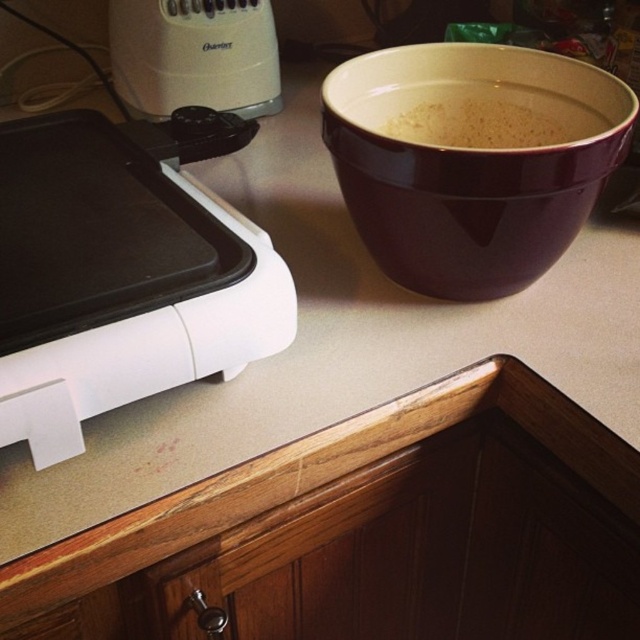
Question: Which point is farther to the camera?

Choices:
 (A) white matte powder at upper center
 (B) white glossy electric griddle at left
 (C) white plastic blender at upper left

Answer: (C)

Question: Can you confirm if white glossy electric griddle at left is positioned to the left of white plastic blender at upper left?

Choices:
 (A) no
 (B) yes

Answer: (B)

Question: In this image, where is white glossy electric griddle at left located relative to white plastic blender at upper left?

Choices:
 (A) below
 (B) above

Answer: (A)

Question: Does white glossy electric griddle at left appear on the right side of white matte powder at upper center?

Choices:
 (A) yes
 (B) no

Answer: (B)

Question: Which object appears farthest from the camera in this image?

Choices:
 (A) white matte powder at upper center
 (B) white plastic blender at upper left

Answer: (B)

Question: Which object is farther from the camera taking this photo?

Choices:
 (A) white plastic blender at upper left
 (B) white matte powder at upper center
 (C) white glossy electric griddle at left

Answer: (A)